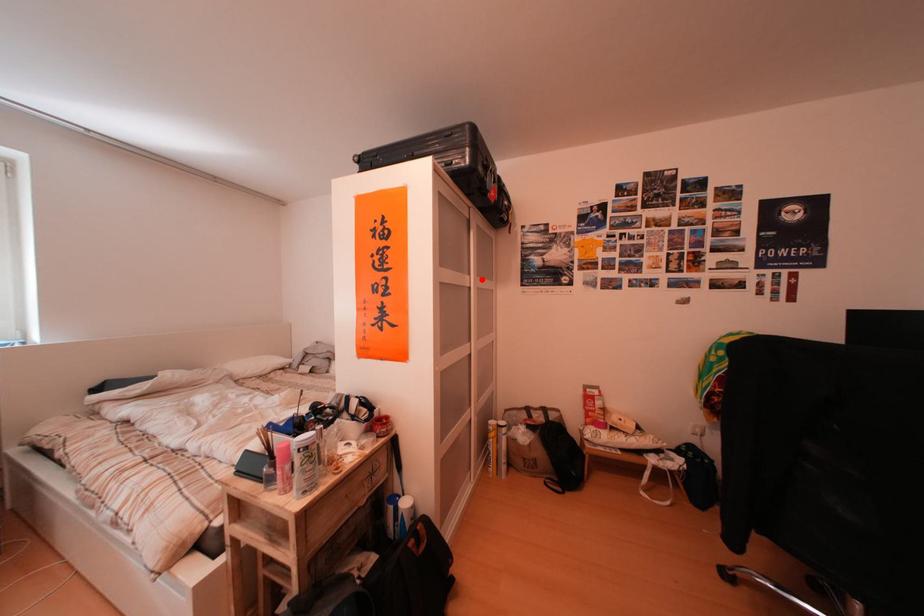
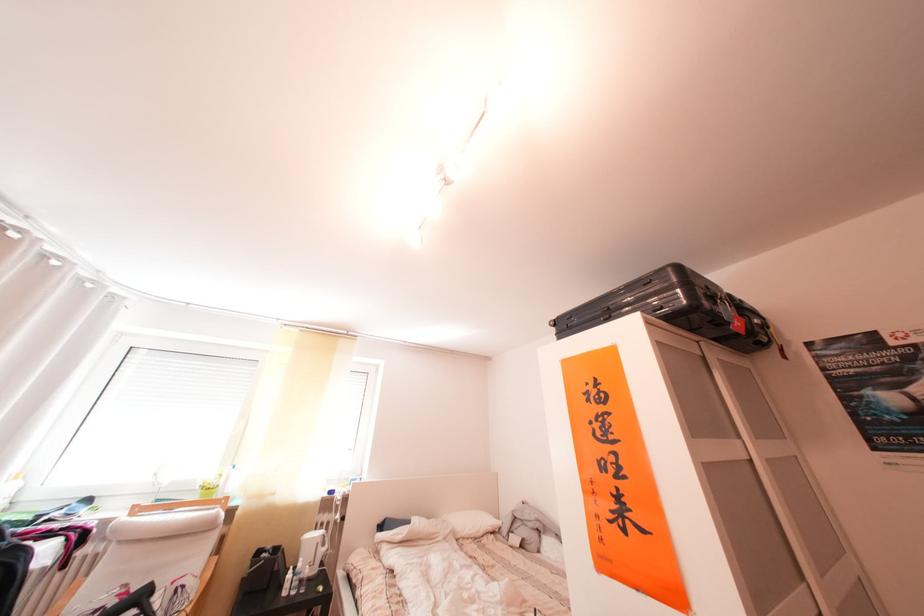
Locate, in the second image, the point that corresponds to the highlighted location in the first image.

(751, 442)